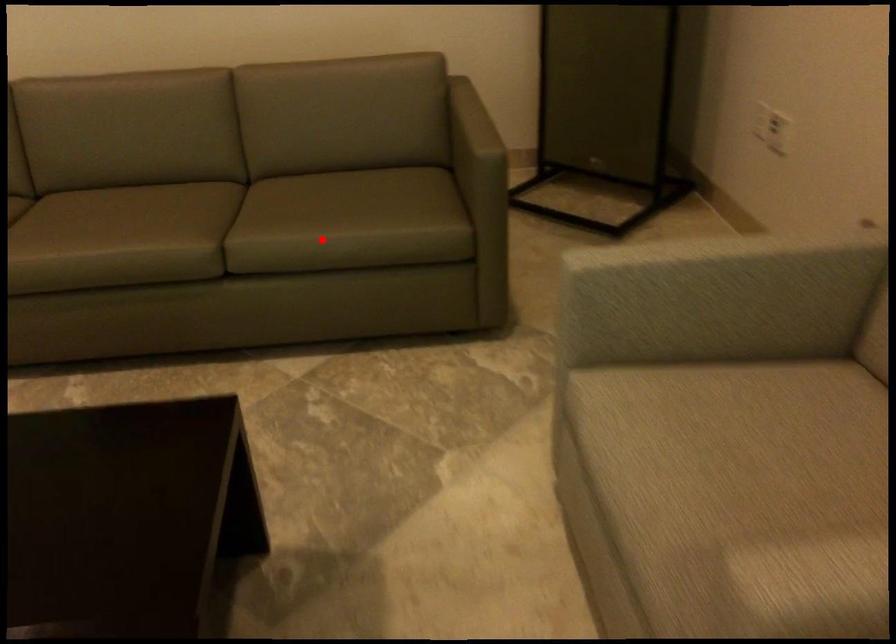
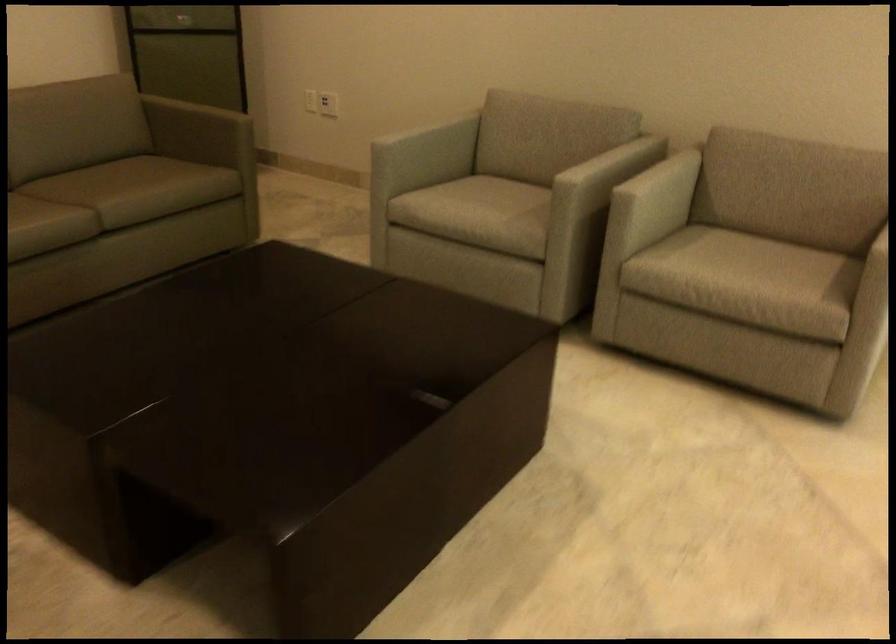
Question: I am providing you with two images of the same scene from different viewpoints. Image1 has a red point marked. In image2, the corresponding 3D location appears at what relative position? Reply with the corresponding letter.

Choices:
 (A) Closer
 (B) Farther

Answer: (B)